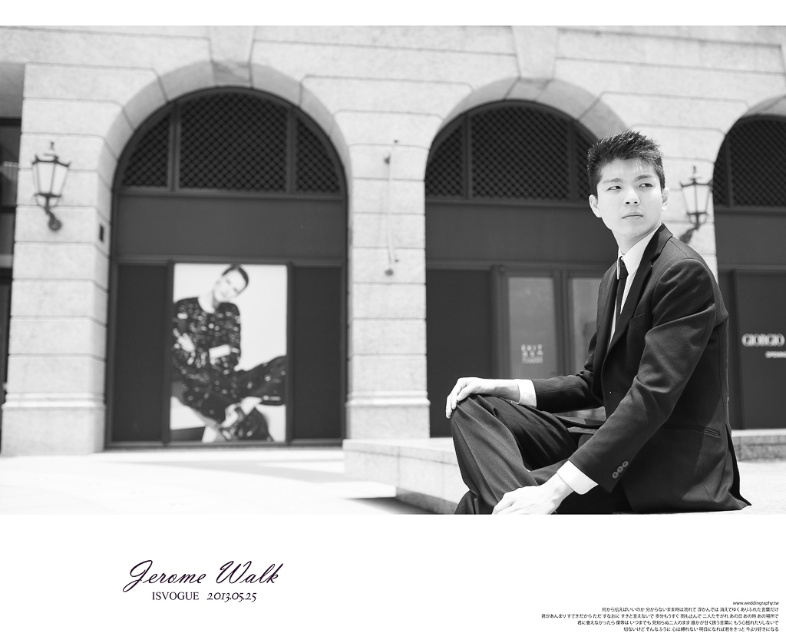
Question: Which object appears closest to the camera in this image?

Choices:
 (A) smooth black suit at right
 (B) matte black tie at center

Answer: (A)

Question: Observing the image, what is the correct spatial positioning of smooth black suit at right in reference to matte black tie at center?

Choices:
 (A) below
 (B) above

Answer: (A)

Question: From the image, what is the correct spatial relationship of smooth black suit at right in relation to matte black tie at center?

Choices:
 (A) below
 (B) above

Answer: (A)

Question: Where is smooth black suit at right located in relation to matte black tie at center in the image?

Choices:
 (A) left
 (B) right

Answer: (A)

Question: Which of the following is the farthest from the observer?

Choices:
 (A) (619, 284)
 (B) (612, 435)

Answer: (A)